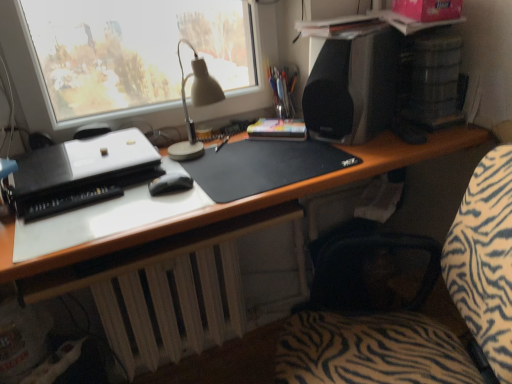
Question: Is black plastic printer at left turned away from metallic silver pen holder at upper center?

Choices:
 (A) no
 (B) yes

Answer: (A)

Question: Can you confirm if black plastic printer at left is smaller than metallic silver pen holder at upper center?

Choices:
 (A) yes
 (B) no

Answer: (B)

Question: From the image's perspective, is black plastic printer at left beneath metallic silver pen holder at upper center?

Choices:
 (A) no
 (B) yes

Answer: (B)

Question: Is the depth of black plastic printer at left less than that of metallic silver pen holder at upper center?

Choices:
 (A) yes
 (B) no

Answer: (A)

Question: Is black plastic printer at left far away from metallic silver pen holder at upper center?

Choices:
 (A) yes
 (B) no

Answer: (B)

Question: Considering the relative sizes of black plastic printer at left and metallic silver pen holder at upper center in the image provided, is black plastic printer at left wider than metallic silver pen holder at upper center?

Choices:
 (A) no
 (B) yes

Answer: (B)

Question: Is white matte radiator at lower center shorter than black matte desk at center?

Choices:
 (A) no
 (B) yes

Answer: (B)

Question: Does white matte radiator at lower center have a smaller size compared to black matte desk at center?

Choices:
 (A) yes
 (B) no

Answer: (A)

Question: From the image's perspective, is white matte radiator at lower center on top of black matte desk at center?

Choices:
 (A) yes
 (B) no

Answer: (B)

Question: Is white matte radiator at lower center bigger than black matte desk at center?

Choices:
 (A) yes
 (B) no

Answer: (B)

Question: Is white matte radiator at lower center not within black matte desk at center?

Choices:
 (A) yes
 (B) no

Answer: (B)

Question: From a real-world perspective, is white matte radiator at lower center located higher than black matte desk at center?

Choices:
 (A) no
 (B) yes

Answer: (A)

Question: Is zebra-patterned fabric at center taller than metallic silver pen holder at upper center?

Choices:
 (A) no
 (B) yes

Answer: (B)